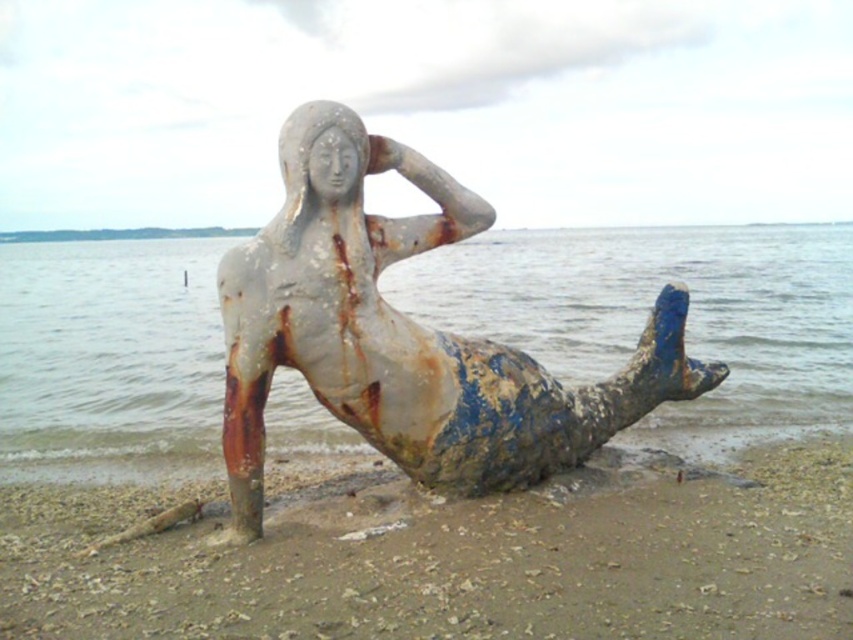
Question: Does rusty metallic water at center have a greater width compared to rusty metal mermaid at center?

Choices:
 (A) yes
 (B) no

Answer: (A)

Question: Is rusty metallic water at center smaller than rusty metal mermaid at center?

Choices:
 (A) no
 (B) yes

Answer: (A)

Question: Does rusty metallic sand at lower center appear on the right side of rusty metal mermaid at center?

Choices:
 (A) no
 (B) yes

Answer: (A)

Question: Which point is closer to the camera?

Choices:
 (A) rusty metal mermaid at center
 (B) rusty metallic sand at lower center
 (C) rusty metallic water at center

Answer: (B)

Question: Which point is closer to the camera taking this photo?

Choices:
 (A) (840, 492)
 (B) (422, 188)
 (C) (750, 326)

Answer: (B)

Question: Which object is positioned farthest from the rusty metal mermaid at center?

Choices:
 (A) rusty metallic sand at lower center
 (B) rusty metallic water at center

Answer: (B)